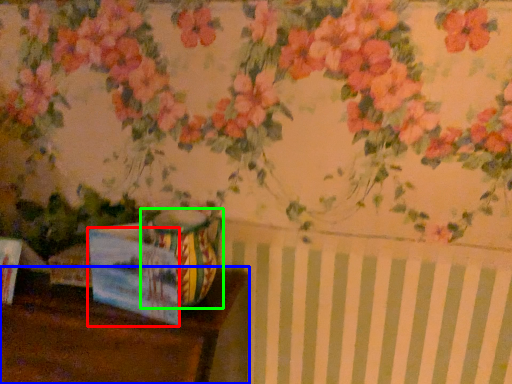
Question: Considering the real-world distances, which object is closest to postcard (highlighted by a red box)? table (highlighted by a blue box) or vase (highlighted by a green box).

Choices:
 (A) table
 (B) vase

Answer: (B)